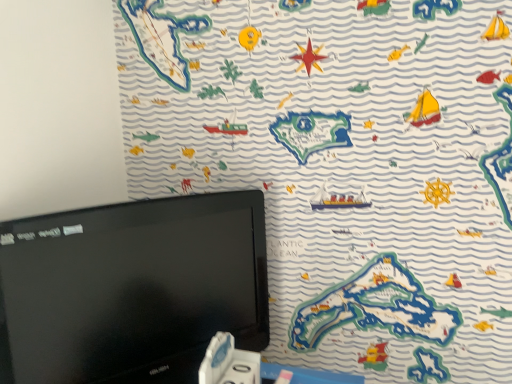
Question: Visually, is black glossy monitor at upper left positioned to the left or to the right of white plastic game controller at bottom?

Choices:
 (A) right
 (B) left

Answer: (B)

Question: Considering the positions of black glossy monitor at upper left and white plastic game controller at bottom in the image, is black glossy monitor at upper left bigger or smaller than white plastic game controller at bottom?

Choices:
 (A) small
 (B) big

Answer: (B)

Question: Considering their positions, is black glossy monitor at upper left located in front of or behind white plastic game controller at bottom?

Choices:
 (A) front
 (B) behind

Answer: (A)

Question: Considering the positions of white plastic game controller at bottom and black glossy monitor at upper left in the image, is white plastic game controller at bottom taller or shorter than black glossy monitor at upper left?

Choices:
 (A) short
 (B) tall

Answer: (A)

Question: Based on their sizes in the image, would you say white plastic game controller at bottom is bigger or smaller than black glossy monitor at upper left?

Choices:
 (A) big
 (B) small

Answer: (B)

Question: Is point (212, 367) closer or farther from the camera than point (193, 241)?

Choices:
 (A) closer
 (B) farther

Answer: (A)

Question: From the image's perspective, relative to black glossy monitor at upper left, is white plastic game controller at bottom above or below?

Choices:
 (A) below
 (B) above

Answer: (A)